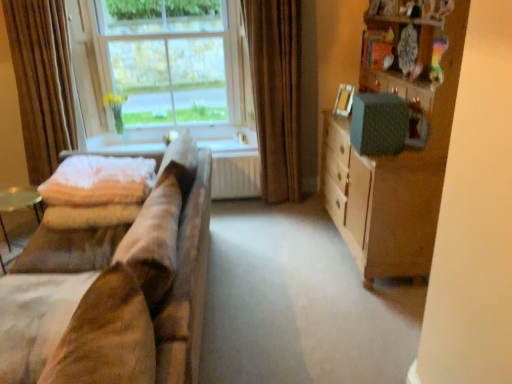
Question: Considering the relative positions of brown velvet curtain at center, which ranks as the 1th curtain in right-to-left order, and suede-like beige couch at left in the image provided, is brown velvet curtain at center, which ranks as the 1th curtain in right-to-left order, to the left of suede-like beige couch at left from the viewer's perspective?

Choices:
 (A) no
 (B) yes

Answer: (A)

Question: Considering the relative sizes of brown velvet curtain at center, arranged as the 2th curtain when viewed from the left, and suede-like beige couch at left in the image provided, is brown velvet curtain at center, arranged as the 2th curtain when viewed from the left, shorter than suede-like beige couch at left?

Choices:
 (A) yes
 (B) no

Answer: (B)

Question: Is brown velvet curtain at center, which ranks as the 1th curtain in right-to-left order, bigger than suede-like beige couch at left?

Choices:
 (A) yes
 (B) no

Answer: (B)

Question: From a real-world perspective, is brown velvet curtain at center, arranged as the 2th curtain when viewed from the left, below suede-like beige couch at left?

Choices:
 (A) yes
 (B) no

Answer: (B)

Question: Could you tell me if brown velvet curtain at center, arranged as the 2th curtain when viewed from the left, is facing suede-like beige couch at left?

Choices:
 (A) no
 (B) yes

Answer: (A)

Question: Can you confirm if brown velvet curtain at center, arranged as the 2th curtain when viewed from the left, is thinner than suede-like beige couch at left?

Choices:
 (A) yes
 (B) no

Answer: (A)

Question: Is brown velvet curtain at center, which ranks as the 1th curtain in right-to-left order, a part of soft pink quilt at left?

Choices:
 (A) yes
 (B) no

Answer: (B)

Question: Is soft pink quilt at left to the right of brown velvet curtain at center, arranged as the 2th curtain when viewed from the left, from the viewer's perspective?

Choices:
 (A) no
 (B) yes

Answer: (A)

Question: From a real-world perspective, is soft pink quilt at left located beneath brown velvet curtain at center, which ranks as the 1th curtain in right-to-left order?

Choices:
 (A) yes
 (B) no

Answer: (A)

Question: Is soft pink quilt at left further to camera compared to brown velvet curtain at center, arranged as the 2th curtain when viewed from the left?

Choices:
 (A) yes
 (B) no

Answer: (B)

Question: Is soft pink quilt at left positioned before brown velvet curtain at center, which ranks as the 1th curtain in right-to-left order?

Choices:
 (A) no
 (B) yes

Answer: (B)

Question: Is soft pink quilt at left facing away from brown velvet curtain at center, arranged as the 2th curtain when viewed from the left?

Choices:
 (A) no
 (B) yes

Answer: (A)

Question: Can you confirm if wooden cabinet at right is smaller than soft pink quilt at left?

Choices:
 (A) yes
 (B) no

Answer: (B)